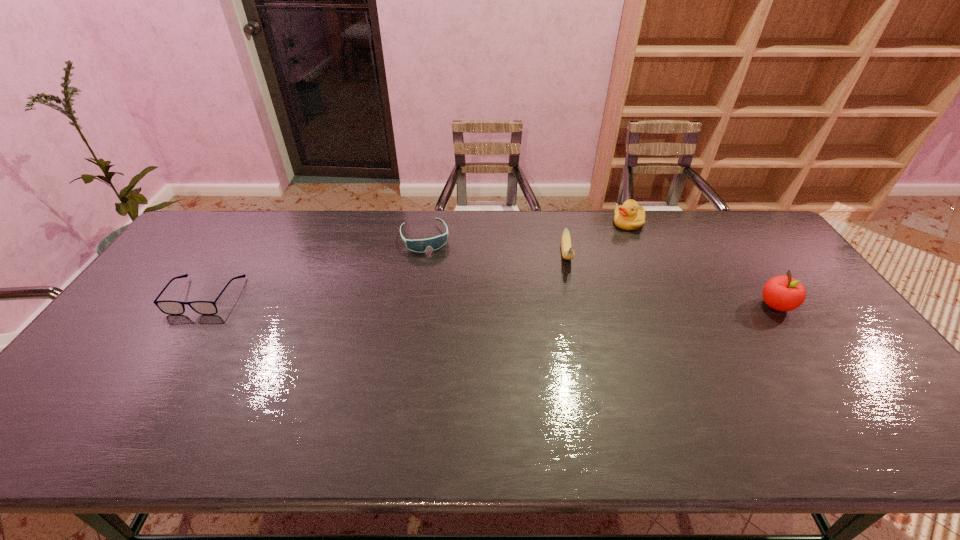
Locate an element on the screen. free region that satisfies the following two spatial constraints: 1. on the front-facing side of the spectacles; 2. on the right side of the rightmost object is located at coordinates (199, 306).

The image size is (960, 540). What are the coordinates of `free spot that satisfies the following two spatial constraints: 1. on the front side of the rightmost object; 2. on the right side of the third object from left to right` in the screenshot? It's located at (578, 306).